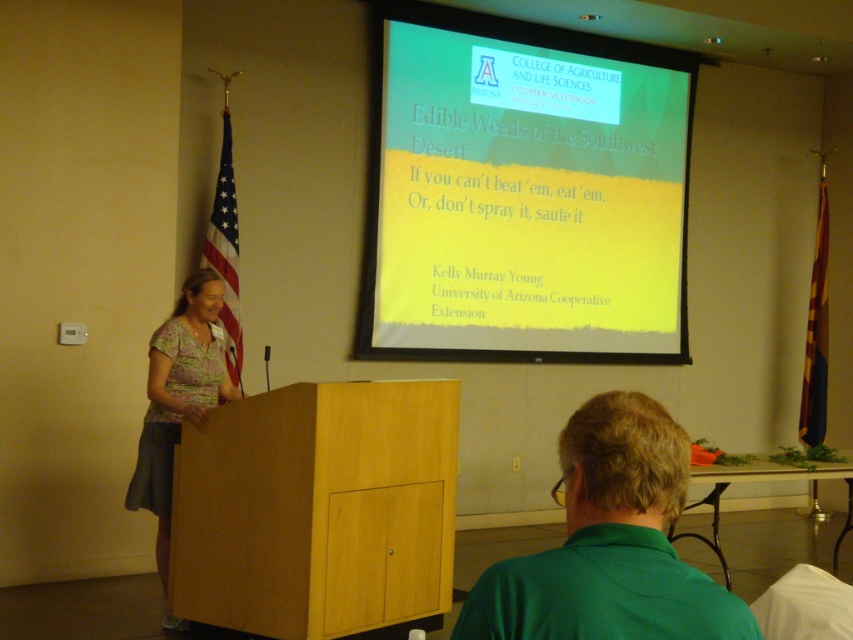
Which is below, green fabric shirt at lower right or floral fabric blouse at left?

floral fabric blouse at left is lower down.

Who is shorter, green fabric shirt at lower right or floral fabric blouse at left?

With less height is green fabric shirt at lower right.

Measure the distance between green fabric shirt at lower right and camera.

1.24 meters

Where is `green fabric shirt at lower right`? green fabric shirt at lower right is located at coordinates (608, 544).

Is yellow matte projection screen at upper center further to camera compared to floral fabric blouse at left?

That is True.

Which is in front, point (567, 310) or point (126, 486)?

Point (126, 486) is more forward.

Where is `yellow matte projection screen at upper center`? The width and height of the screenshot is (853, 640). yellow matte projection screen at upper center is located at coordinates (524, 193).

Which of these two, yellow matte projection screen at upper center or green fabric shirt at lower right, stands taller?

yellow matte projection screen at upper center

Is yellow matte projection screen at upper center bigger than green fabric shirt at lower right?

Answer: Yes.

Who is more forward, (412, 3) or (553, 486)?

Positioned in front is point (553, 486).

I want to click on yellow matte projection screen at upper center, so point(524,193).